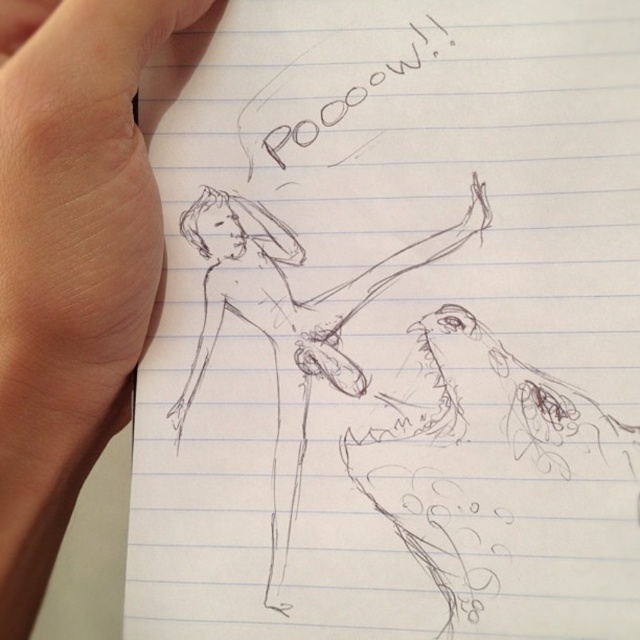
You are an art student who needs to measure the distance between the black sketch figure at center and the skinny flesh at upper left for a project. According to the drawing, how far apart are these two elements?

The black sketch figure at center and the skinny flesh at upper left are 5.22 inches apart.

You are an art student analyzing the sketch. You notice two elements in the drawing. The black sketch figure at center and the skinny flesh at upper left. Which one appears closer to you in the drawing?

The black sketch figure at center appears closer to you because it is positioned further to the viewer than the skinny flesh at upper left.